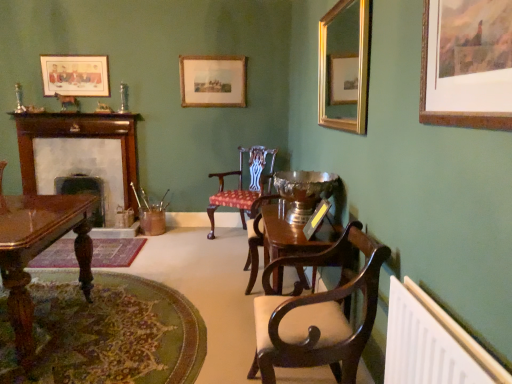
Question: From the image's perspective, is mahogany polished desk at lower left located beneath gold-framed mirror at upper right, which ranks as the 3th picture frame in left-to-right order?

Choices:
 (A) yes
 (B) no

Answer: (A)

Question: From a real-world perspective, is mahogany polished desk at lower left positioned under gold-framed mirror at upper right, which ranks as the 3th picture frame in left-to-right order, based on gravity?

Choices:
 (A) no
 (B) yes

Answer: (B)

Question: Is mahogany polished desk at lower left oriented away from gold-framed mirror at upper right, which ranks as the 3th picture frame in left-to-right order?

Choices:
 (A) yes
 (B) no

Answer: (B)

Question: Considering the relative sizes of mahogany polished desk at lower left and gold-framed mirror at upper right, arranged as the second picture frame when viewed from the right, in the image provided, is mahogany polished desk at lower left wider than gold-framed mirror at upper right, arranged as the second picture frame when viewed from the right,?

Choices:
 (A) no
 (B) yes

Answer: (B)

Question: From the image's perspective, does mahogany polished desk at lower left appear higher than gold-framed mirror at upper right, which ranks as the 3th picture frame in left-to-right order?

Choices:
 (A) yes
 (B) no

Answer: (B)

Question: From their relative heights in the image, would you say wooden fireplace at left, acting as the 1th fireplace starting from the right, is taller or shorter than dark wood fireplace at left, the second fireplace from the right?

Choices:
 (A) short
 (B) tall

Answer: (B)

Question: In terms of size, does wooden fireplace at left, which is the second fireplace in left-to-right order, appear bigger or smaller than dark wood fireplace at left, arranged as the first fireplace when viewed from the left?

Choices:
 (A) big
 (B) small

Answer: (A)

Question: Considering the positions of wooden fireplace at left, acting as the 1th fireplace starting from the right, and dark wood fireplace at left, the second fireplace from the right, in the image, is wooden fireplace at left, acting as the 1th fireplace starting from the right, wider or thinner than dark wood fireplace at left, the second fireplace from the right,?

Choices:
 (A) wide
 (B) thin

Answer: (B)

Question: Is point (67, 180) positioned closer to the camera than point (93, 182)?

Choices:
 (A) closer
 (B) farther

Answer: (B)

Question: From a real-world perspective, is gold-framed mirror at upper right, which is the 3th picture frame in back-to-front order, physically located above or below dark wood fireplace at left, arranged as the first fireplace when viewed from the left?

Choices:
 (A) below
 (B) above

Answer: (B)

Question: From the image's perspective, is gold-framed mirror at upper right, which ranks as the 3th picture frame in left-to-right order, positioned above or below dark wood fireplace at left, the second fireplace from the right?

Choices:
 (A) above
 (B) below

Answer: (A)

Question: Is gold-framed mirror at upper right, which ranks as the 3th picture frame in left-to-right order, to the left or to the right of dark wood fireplace at left, arranged as the first fireplace when viewed from the left, in the image?

Choices:
 (A) right
 (B) left

Answer: (A)

Question: Considering the positions of gold-framed mirror at upper right, arranged as the second picture frame when viewed from the right, and dark wood fireplace at left, the second fireplace from the right, in the image, is gold-framed mirror at upper right, arranged as the second picture frame when viewed from the right, taller or shorter than dark wood fireplace at left, the second fireplace from the right,?

Choices:
 (A) short
 (B) tall

Answer: (B)

Question: In terms of height, does white plastic radiator at lower right look taller or shorter compared to mahogany wood chair with upholstered seat at center, which ranks as the second chair in front-to-back order?

Choices:
 (A) tall
 (B) short

Answer: (B)

Question: From a real-world perspective, relative to mahogany wood chair with upholstered seat at center, which appears as the 1th chair when viewed from the back, is white plastic radiator at lower right vertically above or below?

Choices:
 (A) below
 (B) above

Answer: (B)